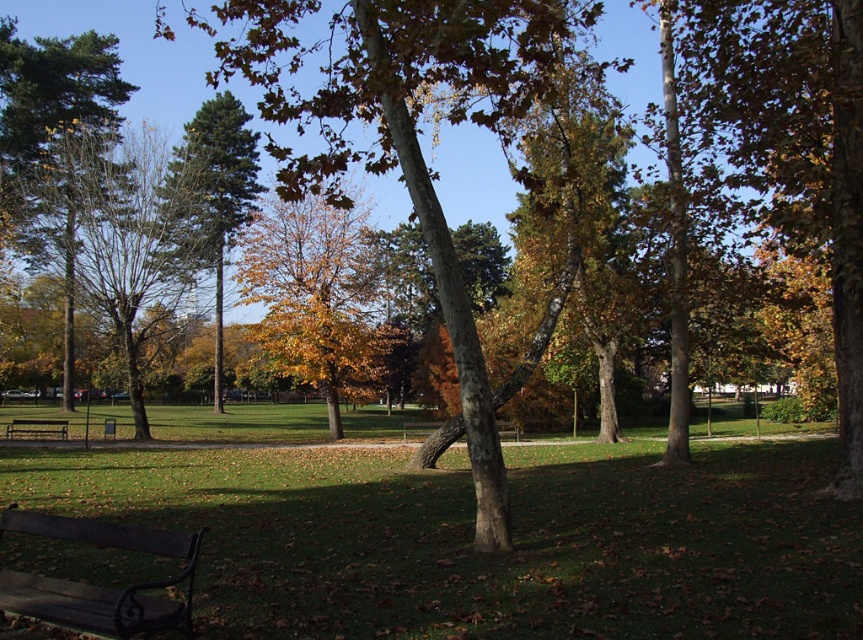
You are planning to install a small garden bench in the park. The bench requires a space of 2 meters between the green grass at center and the green glossy tree at center. Is the current distance sufficient for placing the bench?

The distance between the green grass at center and the green glossy tree at center is 18.48 meters, which is more than enough to accommodate the bench requiring 2 meters of space.

In the scene shown: You are standing in the park and want to take a photo of the green glossy tree at center. If your camera has a maximum zoom range of 30 meters, will you be able to capture the tree clearly?

The green glossy tree at center is 29.17 meters away from the viewer. Since the camera can zoom up to 30 meters, it is within range, so yes, you can capture the tree clearly.

Looking at this image, you are standing at the park entrance and want to reach the green grass at center. Based on the coordinates provided, in which direction should you walk to reach it?

The green grass at center is located at coordinates point (x=470, y=538), so you should walk towards the center of the park to reach it.